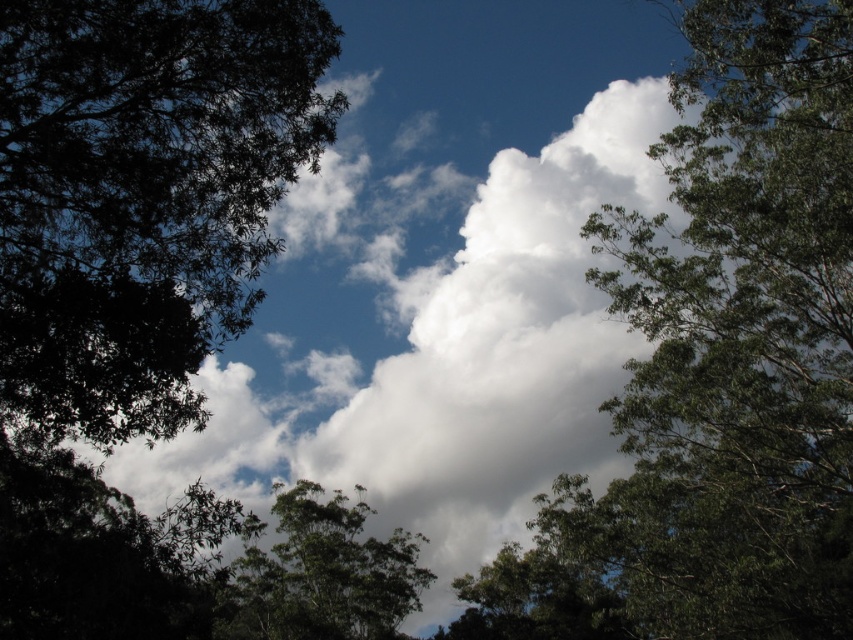
Does green leafy tree at upper right have a lesser width compared to green leafy tree at left?

In fact, green leafy tree at upper right might be wider than green leafy tree at left.

Between green leafy tree at upper right and green leafy tree at left, which one is positioned lower?

green leafy tree at upper right is below.

Locate an element on the screen. This screenshot has height=640, width=853. green leafy tree at upper right is located at coordinates (717, 365).

Identify the location of green leafy tree at upper right. The width and height of the screenshot is (853, 640). (717, 365).

Which of these two, green leafy tree at left or green leafy tree at center, stands taller?

green leafy tree at center is taller.

What do you see at coordinates (143, 195) in the screenshot? I see `green leafy tree at left` at bounding box center [143, 195].

This screenshot has height=640, width=853. In order to click on green leafy tree at left in this screenshot , I will do 143,195.

Locate an element on the screen. green leafy tree at upper right is located at coordinates (717, 365).

Is green leafy tree at upper right taller than green leafy tree at center?

Yes.

Where is `green leafy tree at upper right`? green leafy tree at upper right is located at coordinates (717, 365).